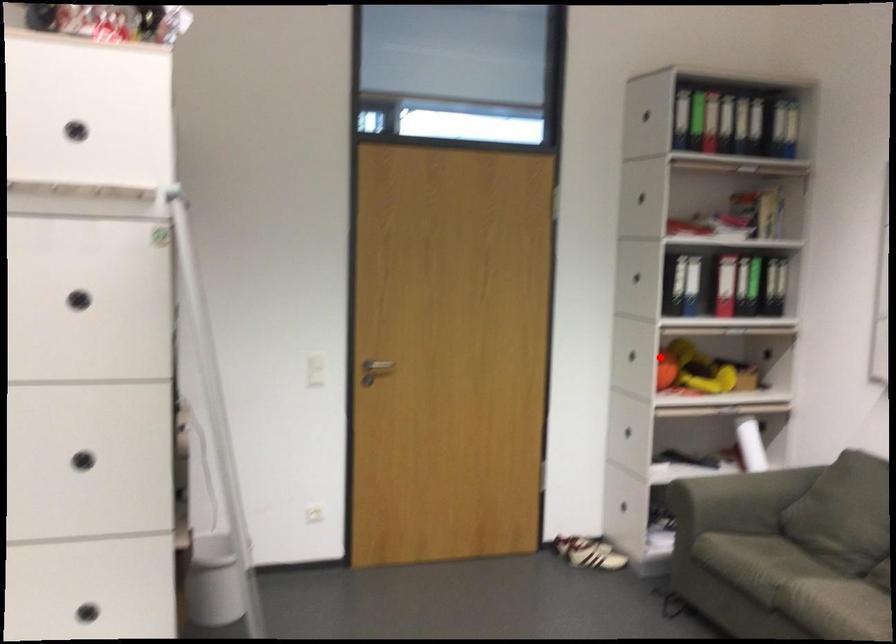
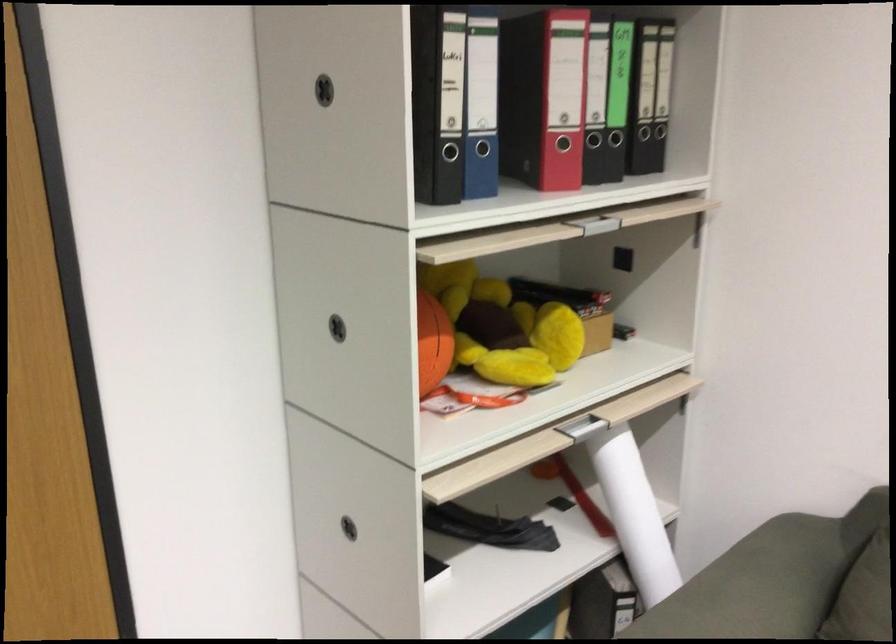
Question: I am providing you with two images of the same scene from different viewpoints. Given a red point in image1, look at the same physical point in image2. Is it:

Choices:
 (A) Closer to the viewpoint
 (B) Farther from the viewpoint

Answer: (A)